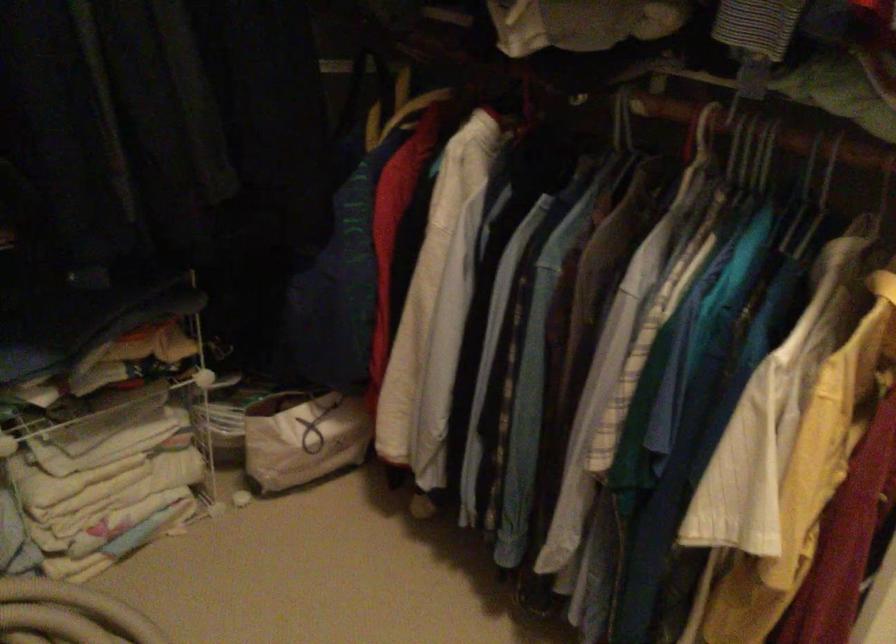
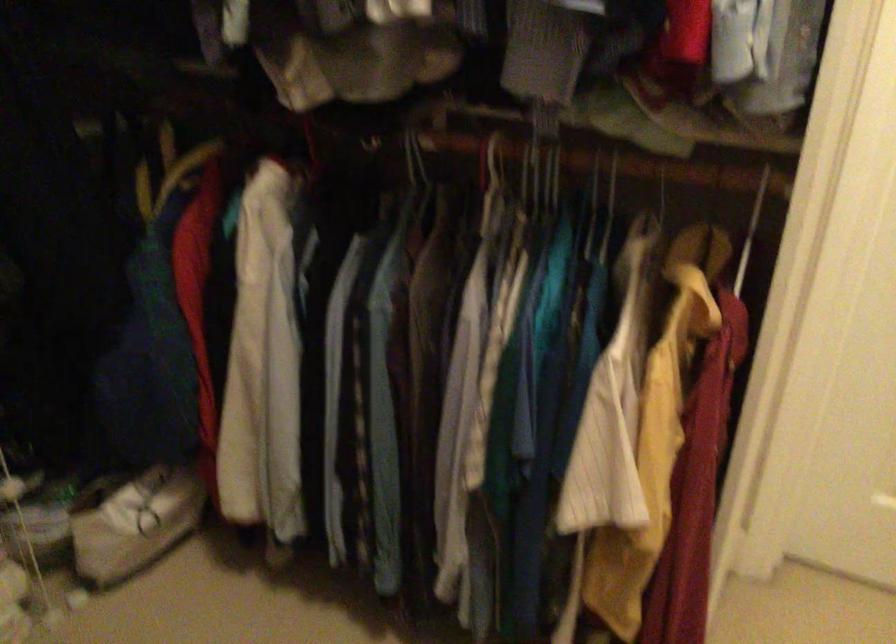
In the second image, find the point that corresponds to (x=312, y=424) in the first image.

(149, 506)